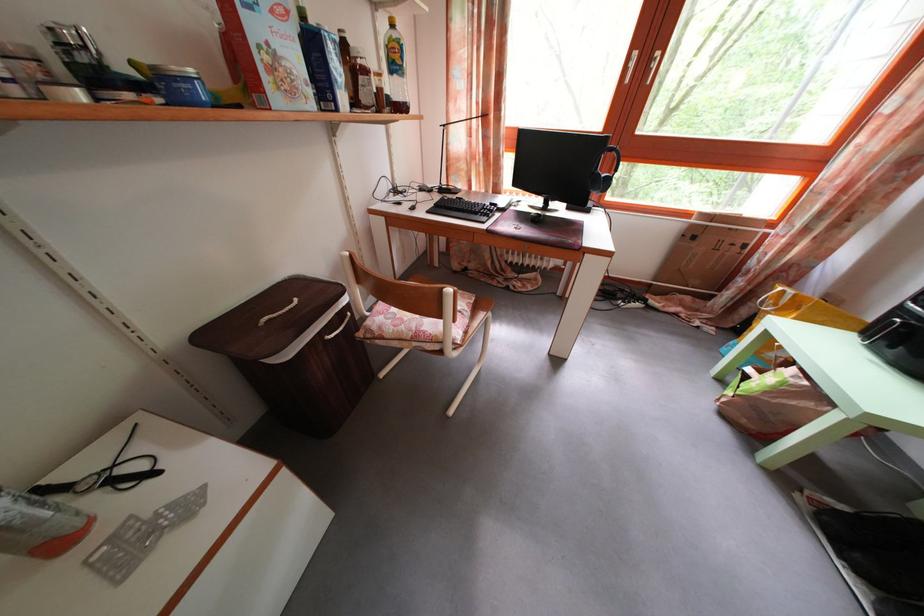
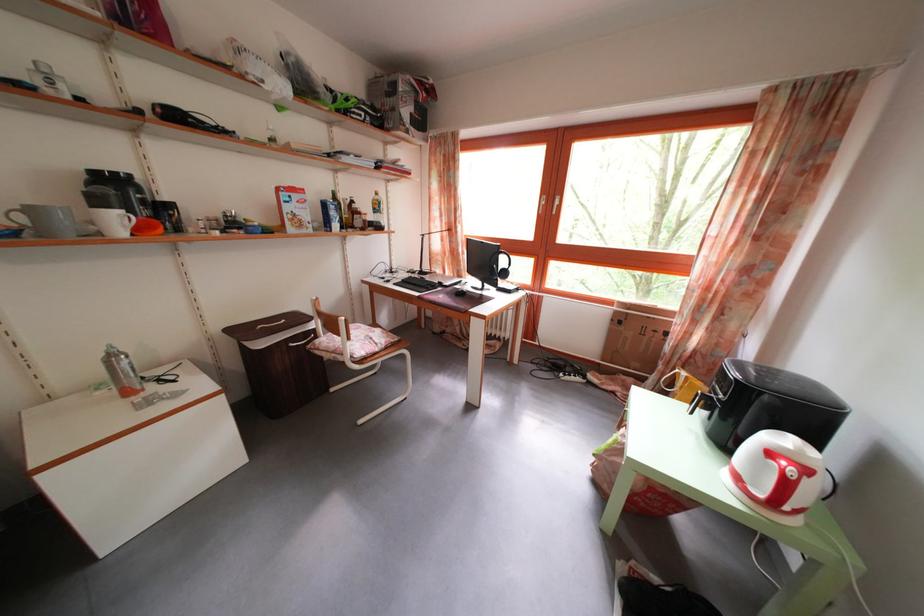
The point at (337, 52) is marked in the first image. Where is the corresponding point in the second image?

(338, 214)